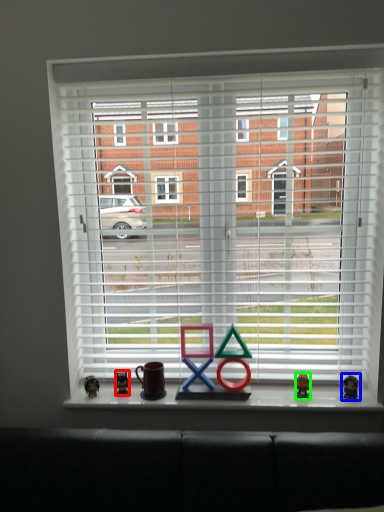
Question: Based on their relative distances, which object is farther from miniature (highlighted by a red box)? Choose from miniature (highlighted by a blue box) and miniature (highlighted by a green box).

Choices:
 (A) miniature
 (B) miniature

Answer: (A)